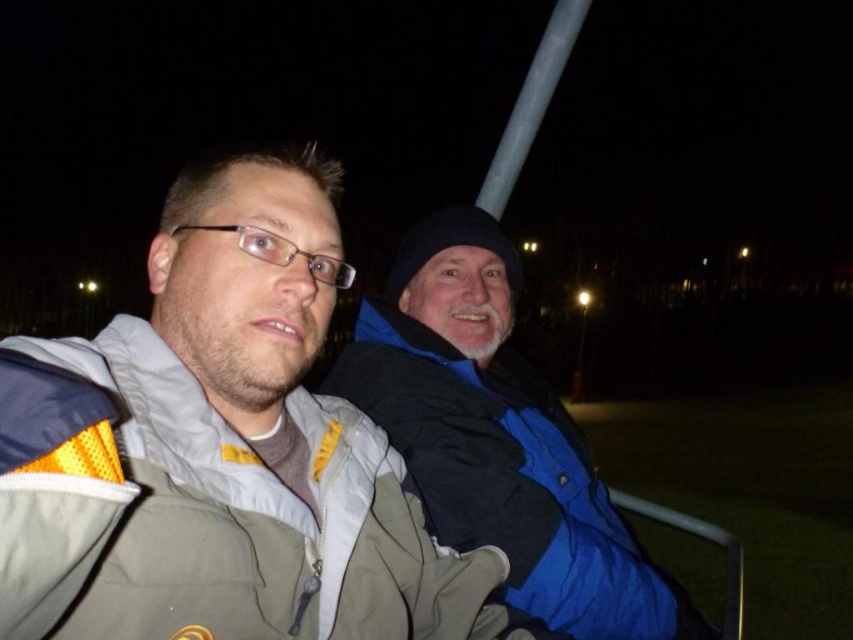
Is blue fleece jacket at right closer to the viewer compared to metallic gray rail at lower right?

That is True.

What are the coordinates of `blue fleece jacket at right` in the screenshot? It's located at pyautogui.click(x=498, y=436).

Who is more distant from viewer, (561, 564) or (656, 515)?

Point (656, 515)

The image size is (853, 640). I want to click on blue fleece jacket at right, so click(x=498, y=436).

Which is more to the left, gray fleece jacket at center or white glossy pole at upper center?

gray fleece jacket at center is more to the left.

Does point (20, 577) come in front of point (491, 186)?

Yes, it is.

The width and height of the screenshot is (853, 640). I want to click on gray fleece jacket at center, so click(219, 451).

This screenshot has width=853, height=640. What do you see at coordinates (219, 451) in the screenshot?
I see `gray fleece jacket at center` at bounding box center [219, 451].

Who is shorter, gray fleece jacket at center or metallic gray rail at lower right?

With less height is metallic gray rail at lower right.

Does point (273, 508) lie behind point (651, 500)?

That is False.

Where is `gray fleece jacket at center`? This screenshot has width=853, height=640. gray fleece jacket at center is located at coordinates (219, 451).